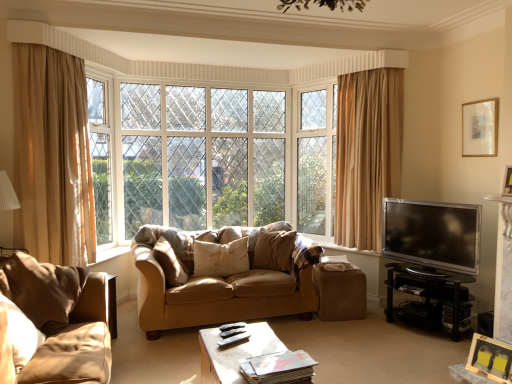
Question: From a real-world perspective, is wooden coffee table at center, which is counted as the 2th table, starting from the back, positioned above or below suede couch at center, which is the second studio couch in left-to-right order?

Choices:
 (A) below
 (B) above

Answer: (A)

Question: Based on their sizes in the image, would you say wooden coffee table at center, which is counted as the 2th table, starting from the back, is bigger or smaller than suede couch at center, which appears as the second studio couch when viewed from the front?

Choices:
 (A) big
 (B) small

Answer: (B)

Question: Estimate the real-world distances between objects in this image. Which object is closer to the suede couch at center, which is the second studio couch in left-to-right order?

Choices:
 (A) clear glass window at center
 (B) wooden coffee table at center, which is counted as the first table, starting from the front
 (C) silver metallic tv at right
 (D) wooden picture frame at lower right, acting as the 3th picture frame starting from the top
 (E) white painted wood window frame at upper left

Answer: (B)

Question: Which is nearer to the black glass tv stand at right, which is the 1th table from right to left?

Choices:
 (A) clear glass window at center
 (B) suede-like beige sofa at lower left, which appears as the 1th studio couch when viewed from the front
 (C) velvet beige pillow at center, positioned as the 3th pillow in left-to-right order
 (D) beige fabric curtain at left
 (E) wooden picture frame at lower right, marked as the first picture frame in a front-to-back arrangement

Answer: (E)